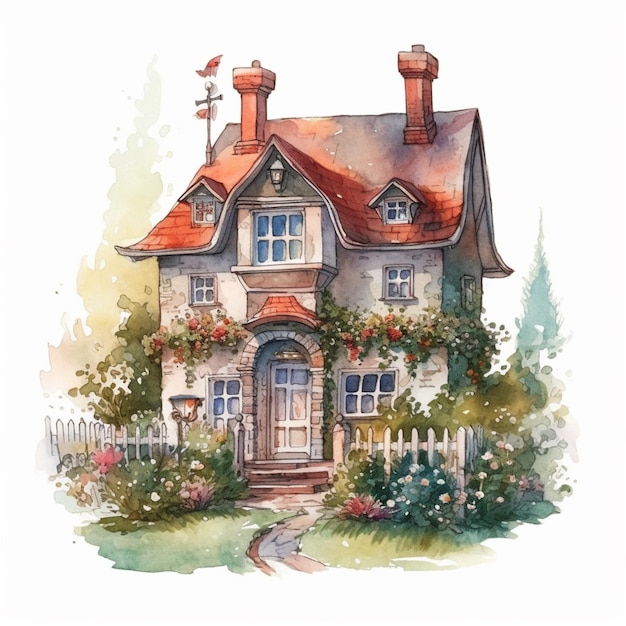
Where is `door`? The height and width of the screenshot is (626, 626). door is located at coordinates (290, 411).